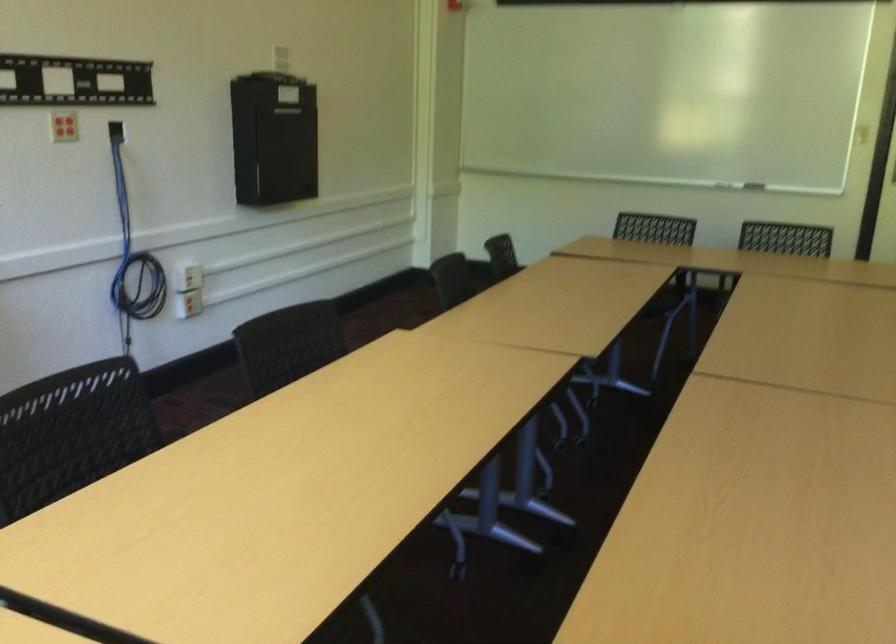
Where would you pull the black box door? Please return your answer as a coordinate pair (x, y).

(273, 138)